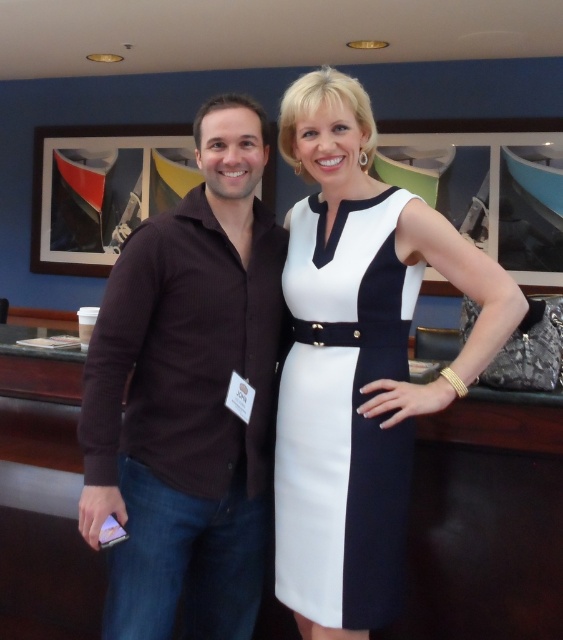
What are the coordinates of the brown ribbed sweater at center?

The brown ribbed sweater at center is located at point (x=189, y=396).

You are at a fashion show and need to identify the correct dress for the runway. The organizers specified that the dress on the right should be leather. Which dress should you choose between the white leather dress at center and the white smooth dress at center?

You should choose the white leather dress at center because it is positioned to the right of the white smooth dress at center, fulfilling the requirement for the dress on the right to be leather.